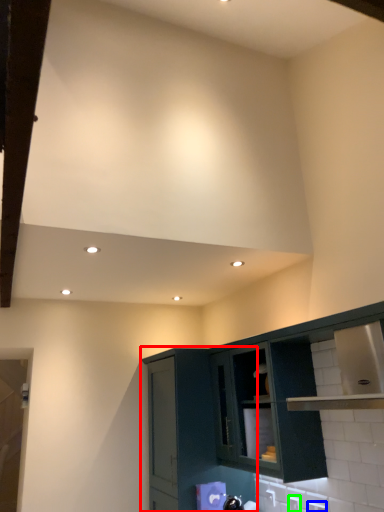
Question: Estimate the real-world distances between objects in this image. Which object is farther from cabinetry (highlighted by a red box), electric outlet (highlighted by a blue box) or electric outlet (highlighted by a green box)?

Choices:
 (A) electric outlet
 (B) electric outlet

Answer: (A)